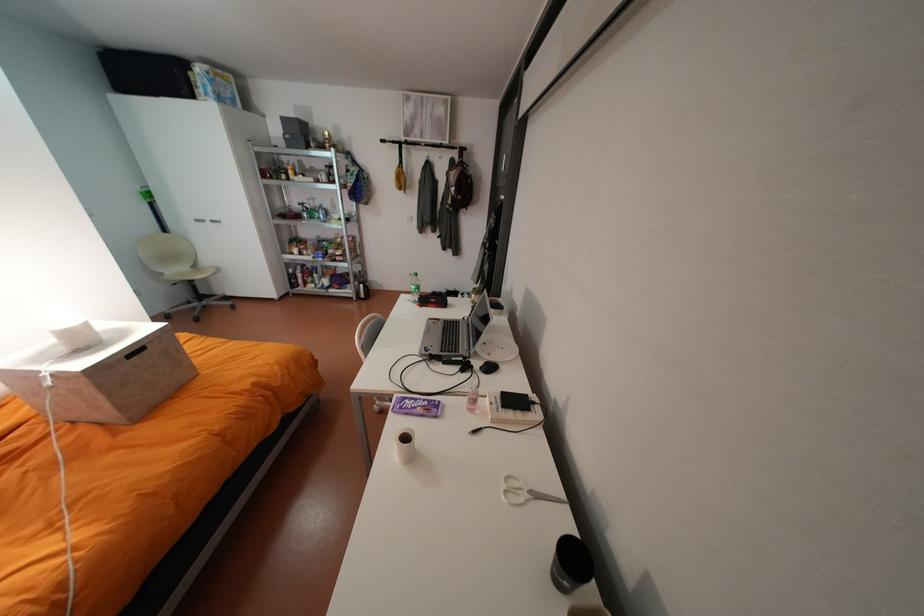
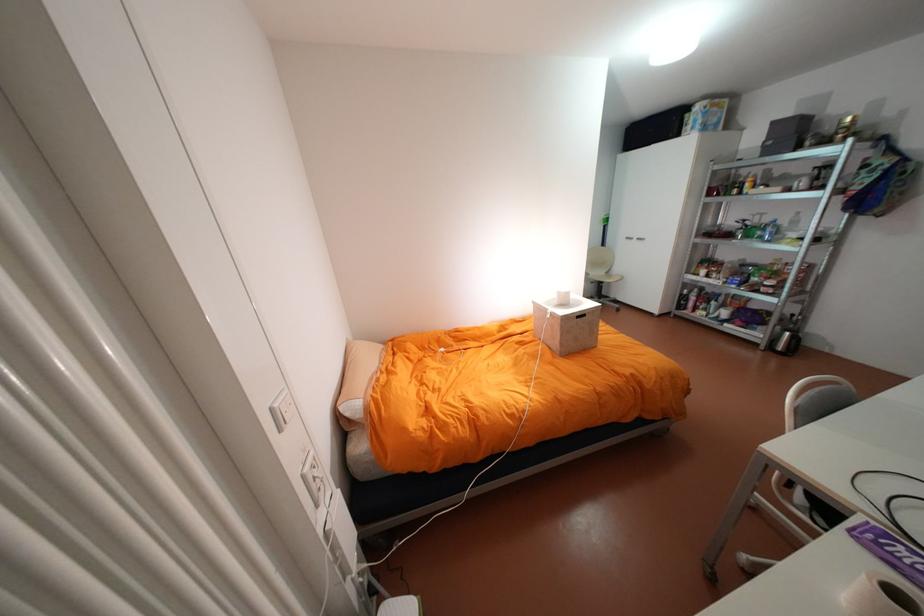
The point at (x=146, y=350) is marked in the first image. Where is the corresponding point in the second image?

(590, 315)